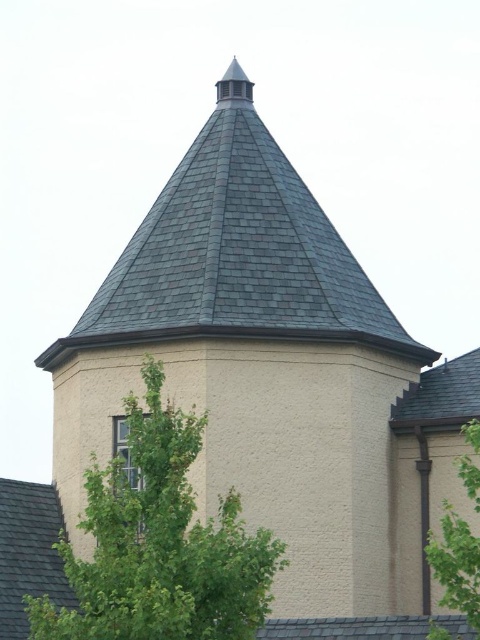
Who is more distant from viewer, (216, 531) or (38, 490)?

Positioned behind is point (38, 490).

The height and width of the screenshot is (640, 480). What do you see at coordinates (159, 544) in the screenshot? I see `green leafy tree at lower left` at bounding box center [159, 544].

You are a GUI agent. You are given a task and a screenshot of the screen. Output one action in this format:
    pyautogui.click(x=<x>, y=<y>)
    Task: Click on the green leafy tree at lower left
    The image size is (480, 640).
    Given the screenshot: What is the action you would take?
    pyautogui.click(x=159, y=544)

The width and height of the screenshot is (480, 640). Describe the element at coordinates (236, 252) in the screenshot. I see `gray shingles at upper center` at that location.

Is gray shingles at upper center taller than green leafy tree at lower left?

Correct, gray shingles at upper center is much taller as green leafy tree at lower left.

The width and height of the screenshot is (480, 640). What are the coordinates of `gray shingles at upper center` in the screenshot? It's located at (236, 252).

Identify the location of gray shingles at upper center. This screenshot has height=640, width=480. (236, 252).

Is green leafy tree at lower left positioned in front of green leafy tree at right?

That is True.

Who is more distant from viewer, [203,525] or [448,504]?

Point [448,504]

Does point (166, 481) come closer to viewer compared to point (476, 506)?

Yes.

I want to click on green leafy tree at lower left, so click(x=159, y=544).